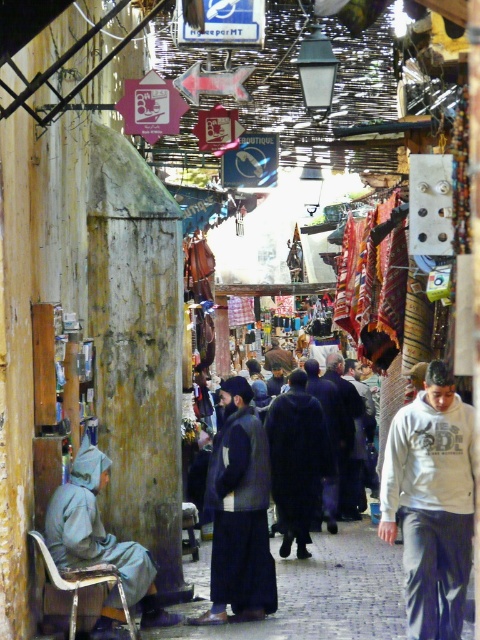
Question: Does gray fabric coat at left appear over dark blue wool coat at center?

Choices:
 (A) no
 (B) yes

Answer: (A)

Question: Which point is closer to the camera?

Choices:
 (A) gray fabric coat at left
 (B) dark blue woolen robe at center
 (C) dark brown fur coat at center
 (D) dark blue wool coat at center

Answer: (A)

Question: Is white cotton hoodie at center-right smaller than dark blue woolen robe at center?

Choices:
 (A) yes
 (B) no

Answer: (A)

Question: Is dark blue woolen robe at center to the right of dark brown fur coat at center from the viewer's perspective?

Choices:
 (A) no
 (B) yes

Answer: (A)

Question: Which of the following is the farthest from the observer?

Choices:
 (A) (61, 506)
 (B) (339, 397)
 (C) (410, 547)

Answer: (B)

Question: Which point is closer to the camera?

Choices:
 (A) gray fabric coat at left
 (B) dark brown fur coat at center

Answer: (A)